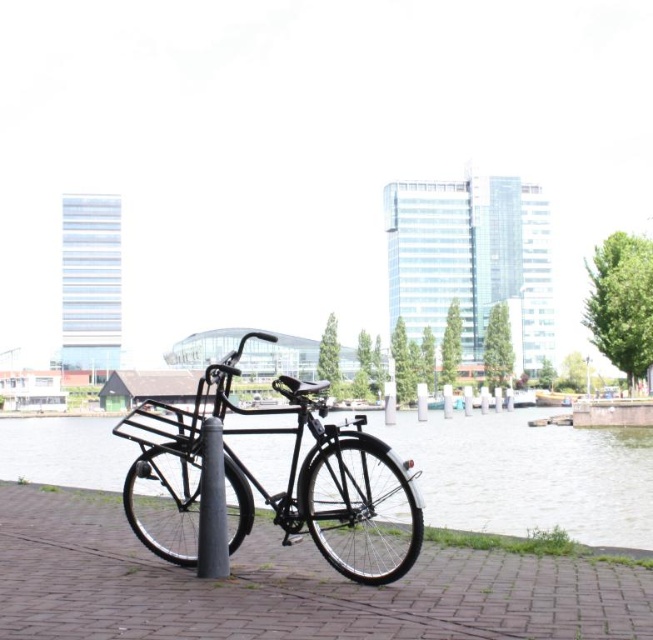
Question: Estimate the real-world distances between objects in this image. Which object is closer to the clear water at center?

Choices:
 (A) matte black bicycle at center
 (B) black brick pavement at center

Answer: (A)

Question: Does black brick pavement at center have a greater width compared to clear water at center?

Choices:
 (A) yes
 (B) no

Answer: (B)

Question: Estimate the real-world distances between objects in this image. Which object is farther from the black brick pavement at center?

Choices:
 (A) matte black bicycle at center
 (B) clear water at center

Answer: (B)

Question: Which object is positioned farthest from the clear water at center?

Choices:
 (A) black brick pavement at center
 (B) matte black bicycle at center

Answer: (A)

Question: Where is black brick pavement at center located in relation to matte black bicycle at center in the image?

Choices:
 (A) above
 (B) below

Answer: (B)

Question: Is black brick pavement at center smaller than clear water at center?

Choices:
 (A) yes
 (B) no

Answer: (A)